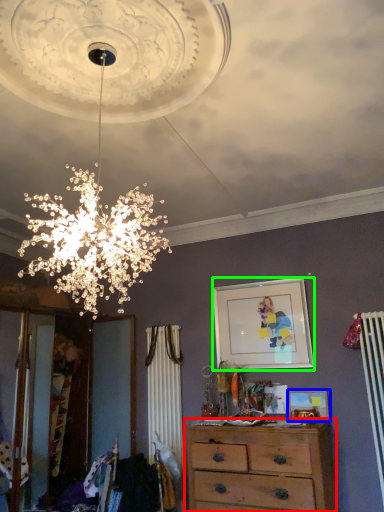
Question: Based on their relative distances, which object is nearer to chest of drawers (highlighted by a red box)? Choose from picture frame (highlighted by a blue box) and picture frame (highlighted by a green box).

Choices:
 (A) picture frame
 (B) picture frame

Answer: (A)